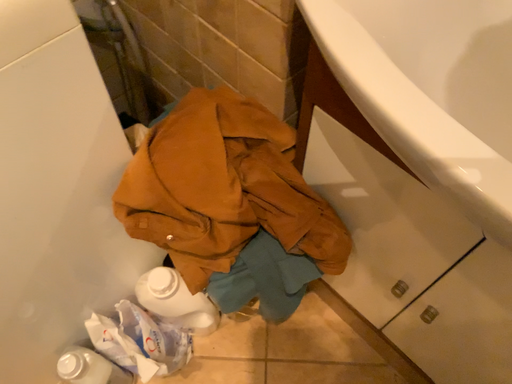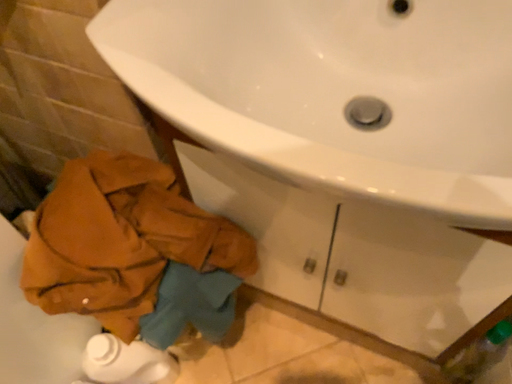
Question: Which way did the camera rotate in the video?

Choices:
 (A) rotated right
 (B) rotated left

Answer: (A)